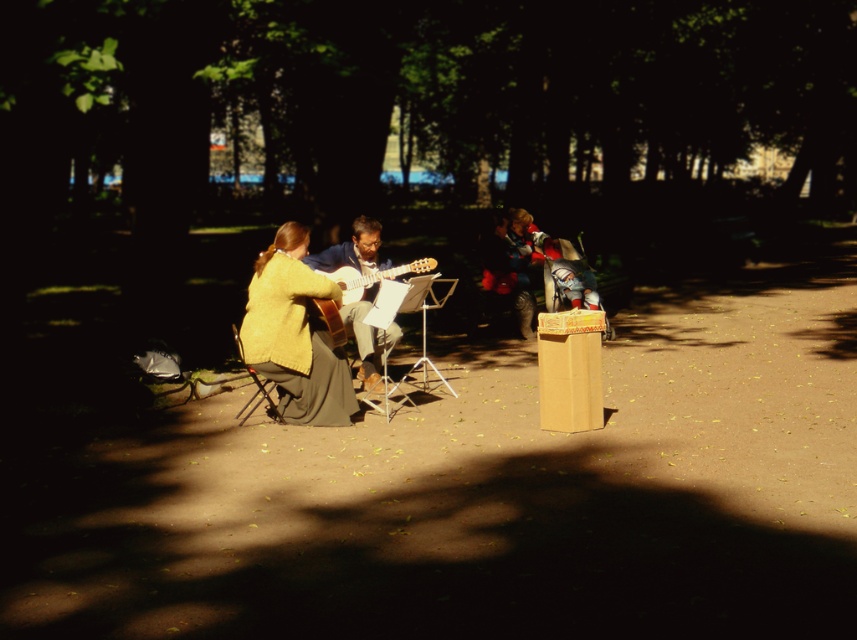
You are standing in the park and see the point at coordinates (294, 333). What object is located there?

The point at coordinates (294, 333) corresponds to the matte yellow sweater at center.